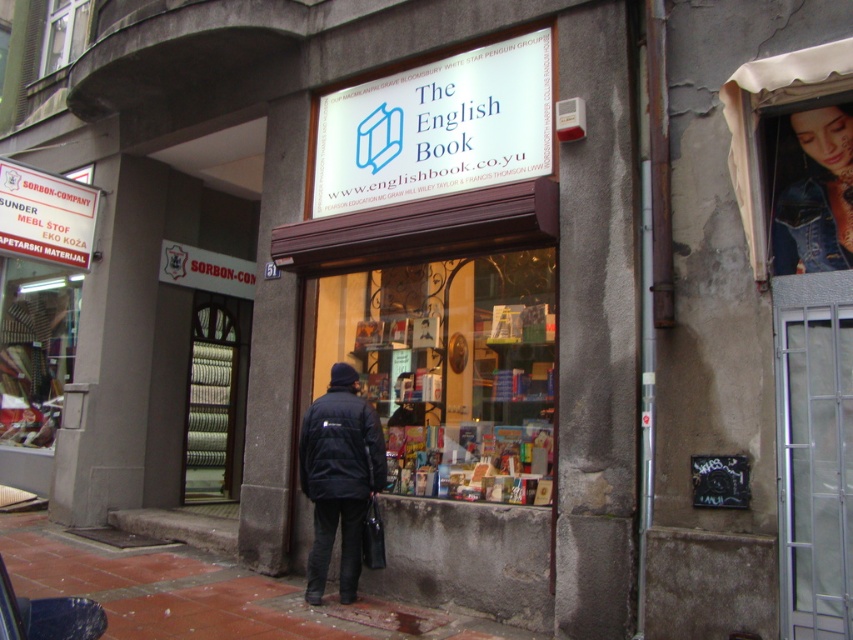
Question: Can you confirm if white plastic sign at center is smaller than white plastic sign at upper left?

Choices:
 (A) yes
 (B) no

Answer: (B)

Question: Which of the following is the farthest from the observer?

Choices:
 (A) (19, 552)
 (B) (519, 36)
 (C) (839, 164)
 (D) (328, 396)

Answer: (A)

Question: Estimate the real-world distances between objects in this image. Which object is farther from the white plastic sign at upper left?

Choices:
 (A) denim jacket at upper right
 (B) white plastic sign at center
 (C) brown brick pavement at lower center

Answer: (A)

Question: Estimate the real-world distances between objects in this image. Which object is farther from the white plastic sign at upper left?

Choices:
 (A) denim jacket at upper right
 (B) black matte jacket at center
 (C) black fabric jacket at center
 (D) white plastic sign at center

Answer: (A)

Question: Is white plastic sign at center thinner than white plastic sign at upper left?

Choices:
 (A) no
 (B) yes

Answer: (A)

Question: Does white plastic sign at center appear on the left side of white plastic sign at upper left?

Choices:
 (A) yes
 (B) no

Answer: (B)